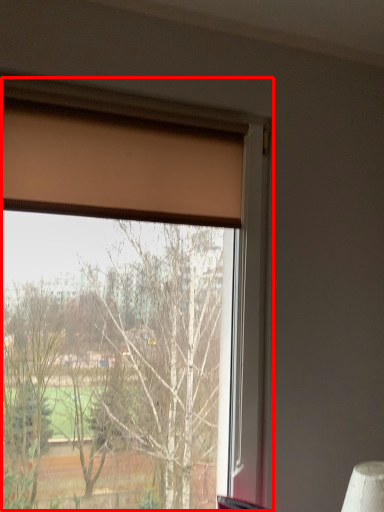
Question: Observing the image, what is the correct spatial positioning of window (annotated by the red box) in reference to curtain?

Choices:
 (A) right
 (B) left

Answer: (A)